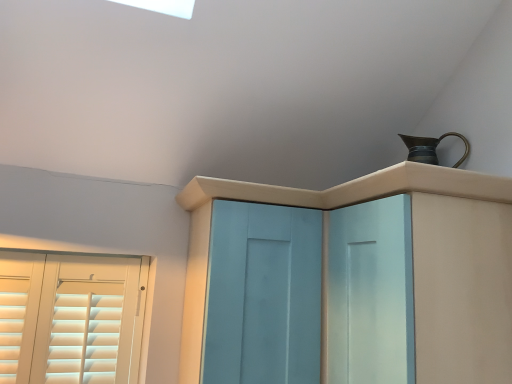
Where is `light blue wood cupboard at upper center`? This screenshot has width=512, height=384. light blue wood cupboard at upper center is located at coordinates (414, 262).

Locate an element on the screen. The height and width of the screenshot is (384, 512). light blue wood cupboard at upper center is located at coordinates (414, 262).

From a real-world perspective, is light blue wood cupboard at upper center below bronze metallic jug at upper right?

Yes, from a real-world perspective, light blue wood cupboard at upper center is under bronze metallic jug at upper right.

Could you tell me if light blue wood cupboard at upper center is facing bronze metallic jug at upper right?

No, light blue wood cupboard at upper center does not turn towards bronze metallic jug at upper right.

Can you confirm if light blue wood cupboard at upper center is bigger than bronze metallic jug at upper right?

Yes.

Does point (222, 205) appear closer or farther from the camera than point (449, 134)?

Point (222, 205).

Is light blue wood screen door at center looking in the opposite direction of bronze metallic jug at upper right?

No.

Is light blue wood screen door at center inside or outside of bronze metallic jug at upper right?

light blue wood screen door at center is not enclosed by bronze metallic jug at upper right.

Is light blue wood screen door at center not close to bronze metallic jug at upper right?

light blue wood screen door at center is actually quite close to bronze metallic jug at upper right.

Considering the relative positions of bronze metallic jug at upper right and light blue wood screen door at center in the image provided, is bronze metallic jug at upper right to the right of light blue wood screen door at center from the viewer's perspective?

Yes.

In the scene shown: Between bronze metallic jug at upper right and light blue wood screen door at center, which one has smaller width?

bronze metallic jug at upper right.

Is light blue wood cupboard at upper center surrounded by light blue wood screen door at center?

Actually, light blue wood cupboard at upper center is outside light blue wood screen door at center.

Which of these two, light blue wood screen door at center or light blue wood cupboard at upper center, is bigger?

With larger size is light blue wood cupboard at upper center.

From a real-world perspective, is light blue wood screen door at center positioned under light blue wood cupboard at upper center based on gravity?

Indeed, from a real-world perspective, light blue wood screen door at center is positioned beneath light blue wood cupboard at upper center.

How different are the orientations of light blue wood cupboard at upper center and light blue wood screen door at center in degrees?

The facing directions of light blue wood cupboard at upper center and light blue wood screen door at center are 88.6 degrees apart.

Measure the distance from light blue wood cupboard at upper center to light blue wood screen door at center.

7.24 inches.

From the picture: Could light blue wood screen door at center be considered to be inside light blue wood cupboard at upper center?

Yes.

Based on their sizes in the image, would you say light blue wood cupboard at upper center is bigger or smaller than light blue wood screen door at center?

In the image, light blue wood cupboard at upper center appears to be larger than light blue wood screen door at center.

Can you see bronze metallic jug at upper right touching light blue wood cupboard at upper center?

No, bronze metallic jug at upper right is not touching light blue wood cupboard at upper center.

Is point (434, 146) closer or farther from the camera than point (477, 266)?

Point (434, 146) is positioned farther from the camera compared to point (477, 266).

Does bronze metallic jug at upper right contain light blue wood cupboard at upper center?

No, light blue wood cupboard at upper center is not surrounded by bronze metallic jug at upper right.

From the image's perspective, relative to light blue wood cupboard at upper center, is bronze metallic jug at upper right above or below?

bronze metallic jug at upper right is situated higher than light blue wood cupboard at upper center in the image.

At what (x,y) coordinates should I click in order to perform the action: click on cupboard in front of the bronze metallic jug at upper right. Please return your answer as a coordinate pair (x, y). The image size is (512, 384). Looking at the image, I should click on (414, 262).

Image resolution: width=512 pixels, height=384 pixels. I want to click on jug that is above the light blue wood screen door at center (from the image's perspective), so click(430, 148).

Estimate the real-world distances between objects in this image. Which object is closer to light blue wood screen door at center, bronze metallic jug at upper right or light blue wood cupboard at upper center?

light blue wood cupboard at upper center is closer to light blue wood screen door at center.

Consider the image. From the image, which object appears to be farther from bronze metallic jug at upper right, light blue wood cupboard at upper center or light blue wood screen door at center?

light blue wood screen door at center is further to bronze metallic jug at upper right.

Which object lies nearer to the anchor point bronze metallic jug at upper right, light blue wood screen door at center or light blue wood cupboard at upper center?

light blue wood cupboard at upper center is positioned closer to the anchor bronze metallic jug at upper right.

Consider the image. When comparing their distances from light blue wood screen door at center, does light blue wood cupboard at upper center or bronze metallic jug at upper right seem closer?

Among the two, light blue wood cupboard at upper center is located nearer to light blue wood screen door at center.

Considering their positions, is light blue wood screen door at center positioned further to light blue wood cupboard at upper center than bronze metallic jug at upper right?

The object further to light blue wood cupboard at upper center is bronze metallic jug at upper right.

Which object lies further to the anchor point light blue wood cupboard at upper center, bronze metallic jug at upper right or light blue wood screen door at center?

Among the two, bronze metallic jug at upper right is located further to light blue wood cupboard at upper center.

The width and height of the screenshot is (512, 384). Find the location of `screen door between light blue wood cupboard at upper center and bronze metallic jug at upper right along the z-axis`. screen door between light blue wood cupboard at upper center and bronze metallic jug at upper right along the z-axis is located at coordinates (263, 295).